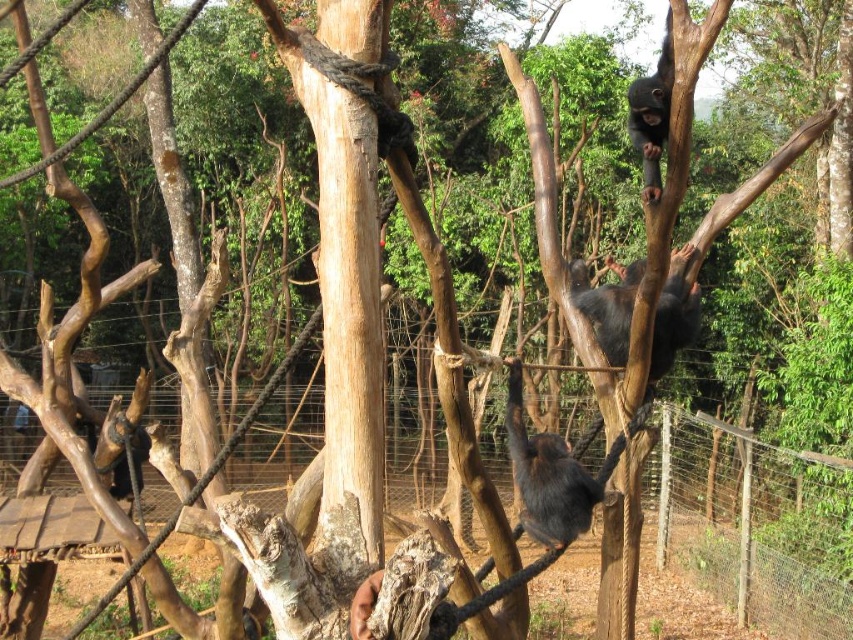
Does shiny black monkey at center appear on the left side of black fur monkey at upper center?

Indeed, shiny black monkey at center is positioned on the left side of black fur monkey at upper center.

Based on the photo, is shiny black monkey at center wider than black fur monkey at upper center?

Incorrect, shiny black monkey at center's width does not surpass black fur monkey at upper center's.

I want to click on shiny black monkey at center, so click(547, 476).

Who is positioned more to the left, wire mesh fence at center or shiny black monkey at center?

wire mesh fence at center is more to the left.

The image size is (853, 640). What do you see at coordinates (292, 561) in the screenshot?
I see `wire mesh fence at center` at bounding box center [292, 561].

Identify the location of wire mesh fence at center. (292, 561).

Does wire mesh fence at center appear on the right side of black fur monkey at upper center?

No, wire mesh fence at center is not to the right of black fur monkey at upper center.

Is point (247, 516) positioned behind point (608, 262)?

No, it is not.

Is point (631, 605) positioned after point (659, 330)?

That is False.

At what (x,y) coordinates should I click in order to perform the action: click on wire mesh fence at center. Please return your answer as a coordinate pair (x, y). Looking at the image, I should click on (292, 561).